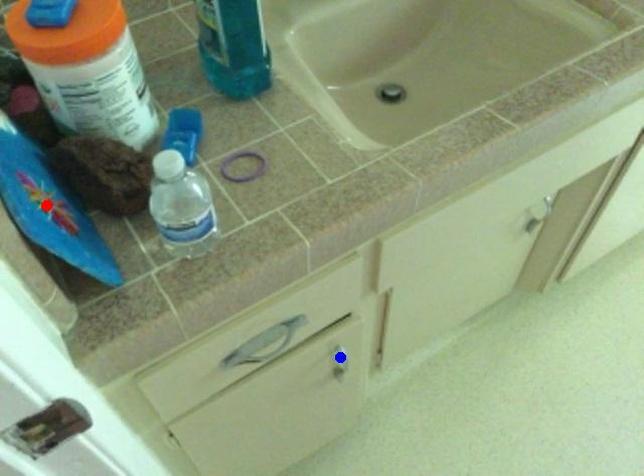
Question: Which of the two points in the image is closer to the camera?

Choices:
 (A) Blue point is closer.
 (B) Red point is closer.

Answer: (B)